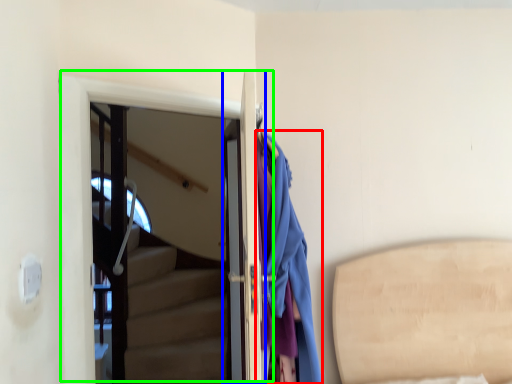
Question: Considering the real-world distances, which object is closest to clothing (highlighted by a red box)? door (highlighted by a blue box) or door (highlighted by a green box).

Choices:
 (A) door
 (B) door

Answer: (A)